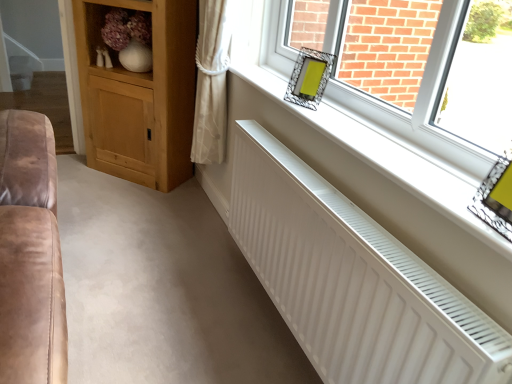
Describe the element at coordinates (496, 197) in the screenshot. The height and width of the screenshot is (384, 512). I see `metallic silver frame at upper right, the 2th picture frame viewed from the back` at that location.

Identify the location of metallic silver picture frame at upper right, positioned as the first picture frame in top-to-bottom order. The width and height of the screenshot is (512, 384). (309, 78).

Where is `metallic silver frame at upper right, the 2th picture frame viewed from the back`? Image resolution: width=512 pixels, height=384 pixels. metallic silver frame at upper right, the 2th picture frame viewed from the back is located at coordinates (496, 197).

Is metallic silver picture frame at upper right, marked as the 1th picture frame in a back-to-front arrangement, surrounded by light brown wood cabinet at left?

That's incorrect, metallic silver picture frame at upper right, marked as the 1th picture frame in a back-to-front arrangement, is not inside light brown wood cabinet at left.

Considering the sizes of objects light brown wood cabinet at left and metallic silver picture frame at upper right, the second picture frame when ordered from right to left, in the image provided, who is shorter, light brown wood cabinet at left or metallic silver picture frame at upper right, the second picture frame when ordered from right to left,?

With less height is metallic silver picture frame at upper right, the second picture frame when ordered from right to left.

Which object is wider, light brown wood cabinet at left or metallic silver picture frame at upper right, the second picture frame positioned from the bottom?

With larger width is light brown wood cabinet at left.

What's the angular difference between light brown wood cabinet at left and metallic silver picture frame at upper right, the second picture frame positioned from the bottom,'s facing directions?

The facing directions of light brown wood cabinet at left and metallic silver picture frame at upper right, the second picture frame positioned from the bottom, are 18.3 degrees apart.

In the image, is white matte radiator at lower center positioned in front of or behind metallic silver frame at upper right, which is counted as the first picture frame, starting from the front?

Clearly, white matte radiator at lower center is behind metallic silver frame at upper right, which is counted as the first picture frame, starting from the front.

How far apart are white matte radiator at lower center and metallic silver frame at upper right, marked as the first picture frame in a bottom-to-top arrangement?

The distance of white matte radiator at lower center from metallic silver frame at upper right, marked as the first picture frame in a bottom-to-top arrangement, is 9.94 inches.

Is metallic silver frame at upper right, the first picture frame from the right, located within white matte radiator at lower center?

No, metallic silver frame at upper right, the first picture frame from the right, is located outside of white matte radiator at lower center.

Between white matte radiator at lower center and metallic silver frame at upper right, arranged as the 2th picture frame when viewed from the left, which one has more height?

metallic silver frame at upper right, arranged as the 2th picture frame when viewed from the left, is taller.

Is white ribbed radiator at lower center looking in the opposite direction of wooden shelf at upper left?

No, white ribbed radiator at lower center's orientation is not away from wooden shelf at upper left.

Considering the points (501, 332) and (90, 54), which point is in front, point (501, 332) or point (90, 54)?

Positioned in front is point (501, 332).

Identify the location of radiator below the wooden shelf at upper left (from a real-world perspective). The image size is (512, 384). (352, 279).

Is white ribbed radiator at lower center to the right of wooden shelf at upper left from the viewer's perspective?

Yes, white ribbed radiator at lower center is to the right of wooden shelf at upper left.

Can white matte radiator at lower center be found inside wooden shelf at upper left?

No, white matte radiator at lower center is not inside wooden shelf at upper left.

In terms of size, does wooden shelf at upper left appear bigger or smaller than white matte radiator at lower center?

Considering their sizes, wooden shelf at upper left takes up more space than white matte radiator at lower center.

Which is in front, wooden shelf at upper left or white matte radiator at lower center?

white matte radiator at lower center is in front.

What's the angular difference between metallic silver picture frame at upper right, which ranks as the 1th picture frame in left-to-right order, and white ribbed radiator at lower center's facing directions?

metallic silver picture frame at upper right, which ranks as the 1th picture frame in left-to-right order, and white ribbed radiator at lower center are facing 22.8 degrees away from each other.

Considering the points (290, 83) and (283, 161), which point is in front, point (290, 83) or point (283, 161)?

Positioned in front is point (283, 161).

From a real-world perspective, who is located lower, metallic silver picture frame at upper right, which ranks as the 1th picture frame in left-to-right order, or white ribbed radiator at lower center?

From a 3D spatial view, white ribbed radiator at lower center is below.

Who is taller, metallic silver picture frame at upper right, which is the second picture frame from front to back, or white ribbed radiator at lower center?

white ribbed radiator at lower center is taller.

Are white matte radiator at lower center and metallic silver picture frame at upper right, positioned as the first picture frame in top-to-bottom order, making contact?

No, white matte radiator at lower center is not touching metallic silver picture frame at upper right, positioned as the first picture frame in top-to-bottom order.

Can you confirm if white matte radiator at lower center is positioned to the left of metallic silver picture frame at upper right, positioned as the first picture frame in top-to-bottom order?

In fact, white matte radiator at lower center is to the right of metallic silver picture frame at upper right, positioned as the first picture frame in top-to-bottom order.

Who is bigger, white matte radiator at lower center or metallic silver picture frame at upper right, which ranks as the 1th picture frame in left-to-right order?

Bigger between the two is white matte radiator at lower center.

From a real-world perspective, is white matte radiator at lower center positioned above or below metallic silver picture frame at upper right, which is the second picture frame from front to back?

Clearly, from a real-world perspective, white matte radiator at lower center is below metallic silver picture frame at upper right, which is the second picture frame from front to back.

Between point (473, 213) and point (308, 51), which one is positioned in front?

Point (473, 213)

From a real-world perspective, relative to metallic silver picture frame at upper right, which ranks as the 1th picture frame in left-to-right order, is metallic silver frame at upper right, which is counted as the first picture frame, starting from the front, vertically above or below?

metallic silver frame at upper right, which is counted as the first picture frame, starting from the front, is above metallic silver picture frame at upper right, which ranks as the 1th picture frame in left-to-right order.

Can you tell me how much metallic silver frame at upper right, arranged as the 2th picture frame when viewed from the left, and metallic silver picture frame at upper right, which is the second picture frame from front to back, differ in facing direction?

The facing directions of metallic silver frame at upper right, arranged as the 2th picture frame when viewed from the left, and metallic silver picture frame at upper right, which is the second picture frame from front to back, are 34.6 degrees apart.

Who is taller, metallic silver frame at upper right, the first picture frame from the right, or metallic silver picture frame at upper right, which is the second picture frame from front to back?

With more height is metallic silver frame at upper right, the first picture frame from the right.

Identify the location of cabinetry above the metallic silver picture frame at upper right, the second picture frame positioned from the bottom (from the image's perspective). This screenshot has width=512, height=384. (140, 95).

Locate an element on the screen. picture frame that is below the white matte radiator at lower center (from the image's perspective) is located at coordinates (496, 197).

Based on their spatial positions, is light brown wood cabinet at left or white matte radiator at lower center closer to white ribbed radiator at lower center?

white matte radiator at lower center.

Estimate the real-world distances between objects in this image. Which object is closer to metallic silver frame at upper right, marked as the first picture frame in a bottom-to-top arrangement, light brown wood cabinet at left or white matte radiator at lower center?

Based on the image, white matte radiator at lower center appears to be nearer to metallic silver frame at upper right, marked as the first picture frame in a bottom-to-top arrangement.

Which object lies further to the anchor point wooden shelf at upper left, white matte radiator at lower center or light brown wood cabinet at left?

The object further to wooden shelf at upper left is white matte radiator at lower center.

From the image, which object appears to be nearer to light brown wood cabinet at left, white ribbed radiator at lower center or white matte radiator at lower center?

white matte radiator at lower center lies closer to light brown wood cabinet at left than the other object.

Which object lies nearer to the anchor point white ribbed radiator at lower center, metallic silver picture frame at upper right, which is the second picture frame from front to back, or metallic silver frame at upper right, arranged as the 2th picture frame when viewed from the left?

Among the two, metallic silver frame at upper right, arranged as the 2th picture frame when viewed from the left, is located nearer to white ribbed radiator at lower center.

Which object lies nearer to the anchor point white ribbed radiator at lower center, metallic silver frame at upper right, arranged as the second picture frame when viewed from the top, or white matte radiator at lower center?

Based on the image, white matte radiator at lower center appears to be nearer to white ribbed radiator at lower center.

Based on their spatial positions, is metallic silver frame at upper right, arranged as the 2th picture frame when viewed from the left, or metallic silver picture frame at upper right, the second picture frame positioned from the bottom, closer to white matte radiator at lower center?

metallic silver frame at upper right, arranged as the 2th picture frame when viewed from the left, is closer to white matte radiator at lower center.

Considering their positions, is metallic silver frame at upper right, marked as the first picture frame in a bottom-to-top arrangement, positioned further to light brown wood cabinet at left than metallic silver picture frame at upper right, which is the second picture frame from front to back?

metallic silver frame at upper right, marked as the first picture frame in a bottom-to-top arrangement.

Find the location of a particular element. The height and width of the screenshot is (384, 512). picture frame that lies between white matte radiator at lower center and white ribbed radiator at lower center from top to bottom is located at coordinates (496, 197).

The width and height of the screenshot is (512, 384). Identify the location of window sill between white ribbed radiator at lower center and metallic silver picture frame at upper right, positioned as the first picture frame in top-to-bottom order, in the front-back direction. (386, 157).

The width and height of the screenshot is (512, 384). Identify the location of picture frame between white matte radiator at lower center and light brown wood cabinet at left from front to back. (309, 78).

Identify the location of picture frame between metallic silver frame at upper right, which is counted as the first picture frame, starting from the front, and wooden shelf at upper left from front to back. (309, 78).